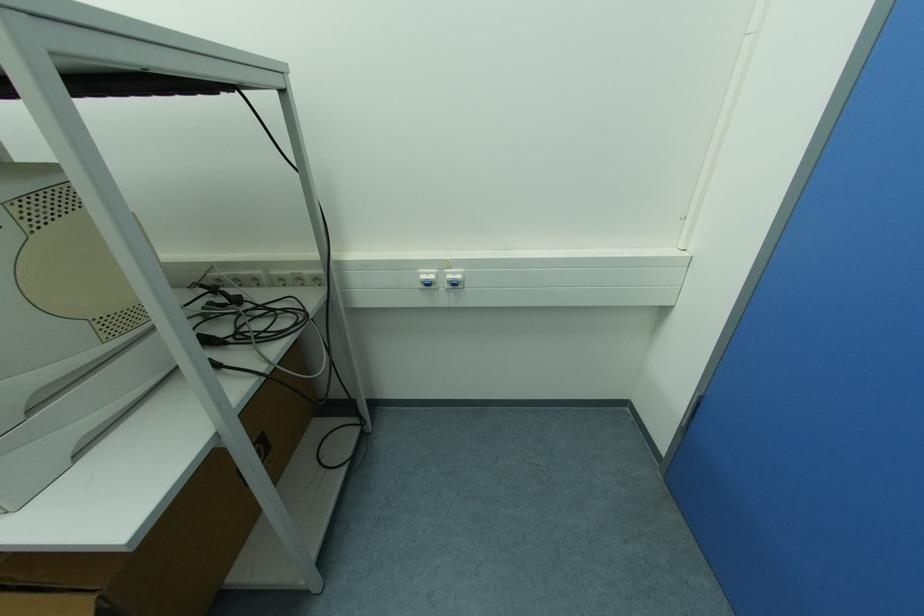
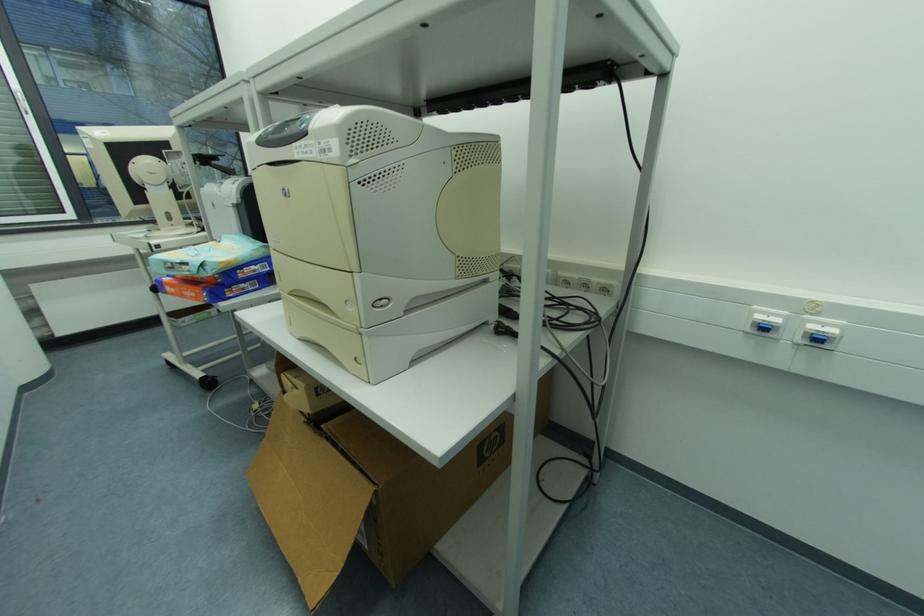
Question: The images are taken continuously from a first-person perspective. In which direction is your viewpoint rotating?

Choices:
 (A) Left
 (B) Right
 (C) Up
 (D) Down

Answer: (A)